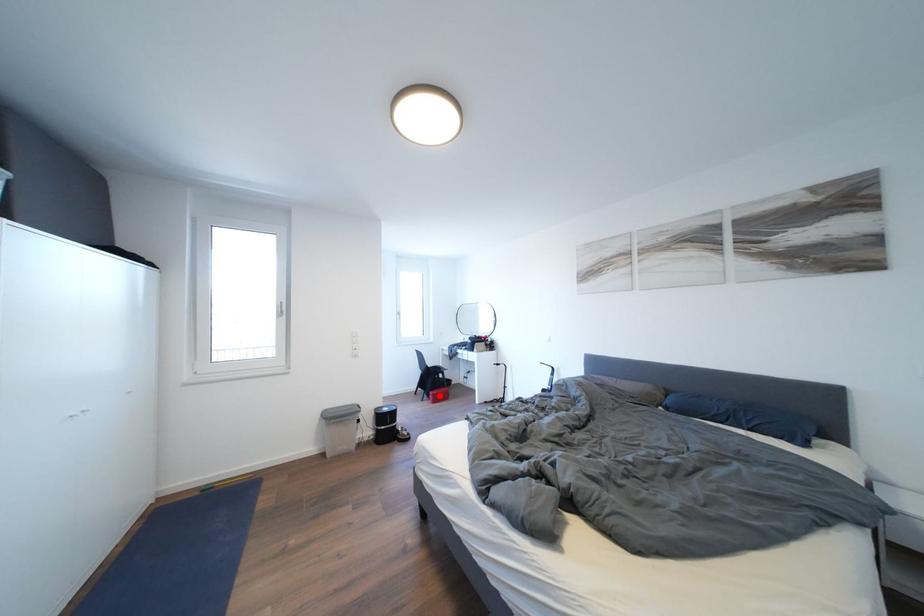
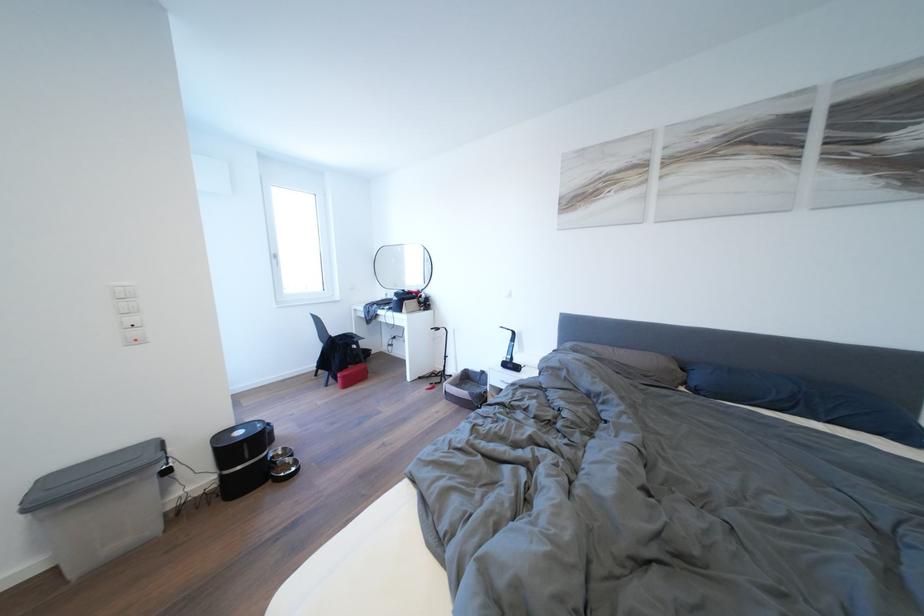
In the second image, find the point that corresponds to the highlighted location in the first image.

(348, 376)